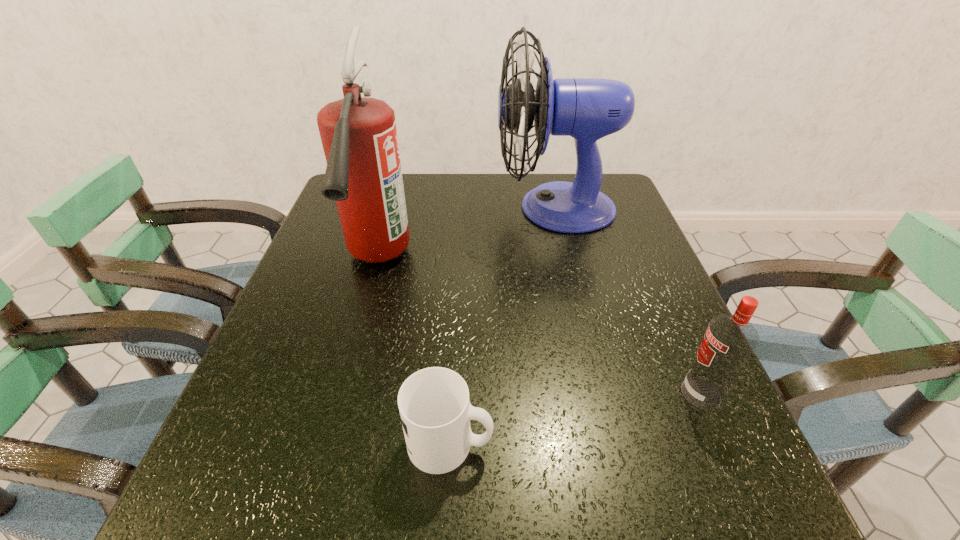
Identify the location of free space at the far edge of the desktop. Image resolution: width=960 pixels, height=540 pixels. (497, 181).

Identify the location of free space at the near edge of the desktop. This screenshot has height=540, width=960. (448, 485).

Locate an element on the screen. This screenshot has width=960, height=540. vacant space at the left edge of the desktop is located at coordinates (342, 242).

In the image, there is a desktop. Where is `free space at the right edge`? The image size is (960, 540). free space at the right edge is located at coordinates (755, 468).

Find the location of a particular element. The height and width of the screenshot is (540, 960). vacant area at the near right corner is located at coordinates (x=715, y=530).

Locate an element on the screen. empty location between the fan and the nearest object is located at coordinates tap(503, 326).

This screenshot has height=540, width=960. I want to click on free point between the second nearest object and the fan, so click(x=628, y=301).

This screenshot has width=960, height=540. In order to click on empty location between the leftmost object and the third farthest object in this screenshot , I will do click(539, 327).

Where is `unoccupied area between the leftmost object and the second object from left to right`? This screenshot has height=540, width=960. unoccupied area between the leftmost object and the second object from left to right is located at coordinates (414, 352).

Identify the location of free space between the fan and the shortest object. (503, 326).